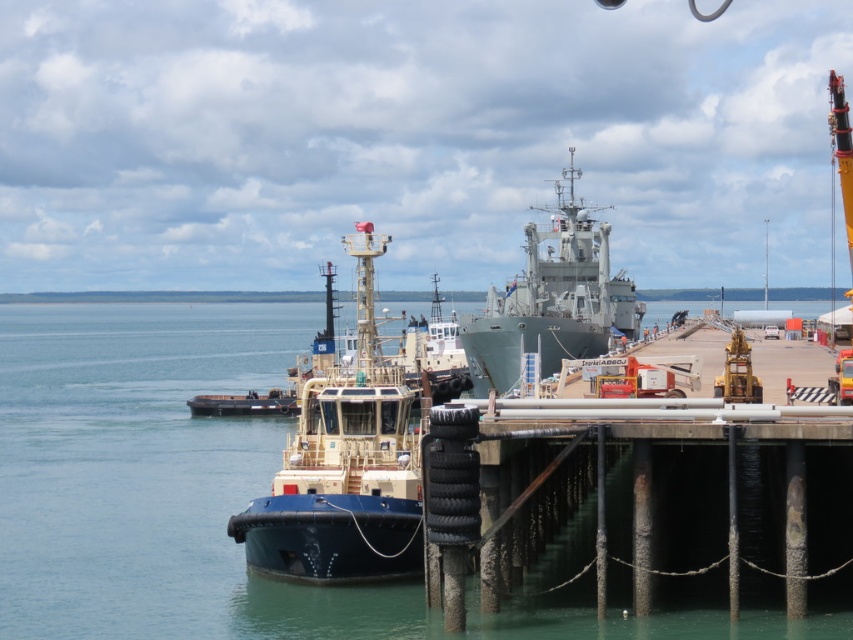
Question: Can you confirm if blue water at center is positioned above gray metallic ship at center?

Choices:
 (A) yes
 (B) no

Answer: (B)

Question: Which of the following is the farthest from the observer?

Choices:
 (A) gray metallic ship at center
 (B) blue matte tugboat at center
 (C) blue water at center

Answer: (A)

Question: Is blue water at center wider than gray metallic ship at center?

Choices:
 (A) no
 (B) yes

Answer: (B)

Question: Which point is farther from the camera taking this photo?

Choices:
 (A) [x=422, y=621]
 (B) [x=554, y=209]

Answer: (B)

Question: Is blue water at center thinner than gray metallic ship at center?

Choices:
 (A) no
 (B) yes

Answer: (A)

Question: Which object is the farthest from the gray metallic ship at center?

Choices:
 (A) blue water at center
 (B) blue matte tugboat at center

Answer: (A)